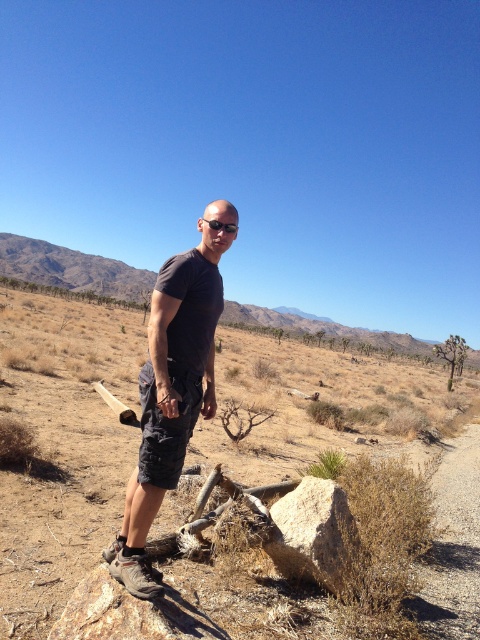
You are a drone operator trying to capture the best aerial shot of the desert scene. You need to ensure that both point (337,493) and point (233,228) are visible in the frame. Considering their positions, which point will appear closer to the camera in the final photo?

Point (233,228) will appear closer to the camera in the final photo because it is positioned closer to the viewer than point (337,493), which is further away.